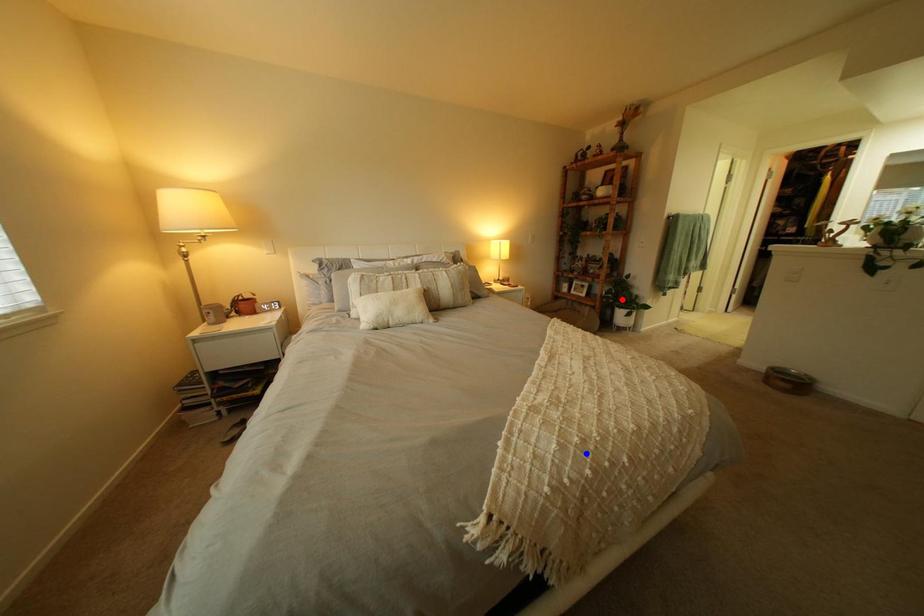
Question: In the image, two points are highlighted. Which point is nearer to the camera? Reply with the corresponding letter.

Choices:
 (A) blue point
 (B) red point

Answer: (A)